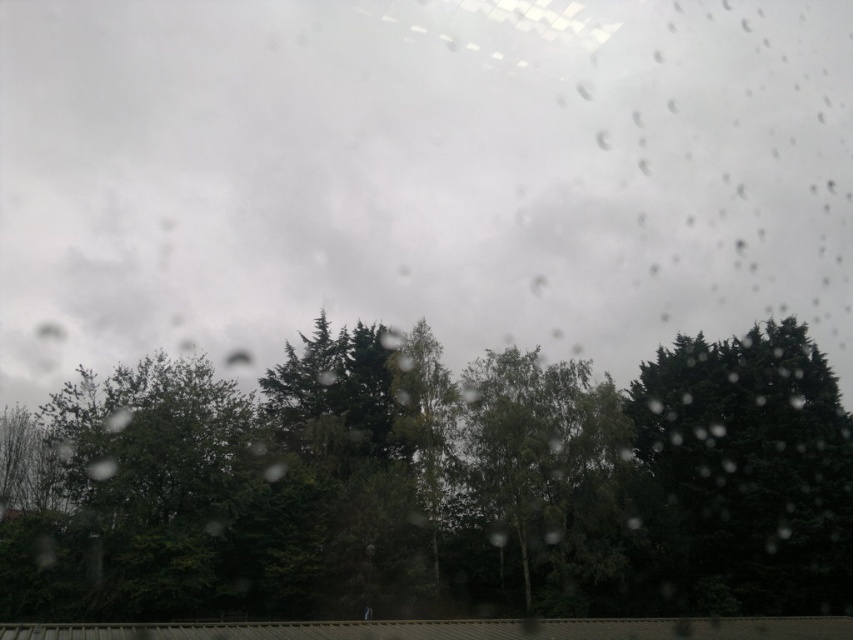
Does green matte tree at center have a smaller size compared to green leafy tree at center?

Actually, green matte tree at center might be larger than green leafy tree at center.

Is point (349, 573) positioned after point (549, 515)?

No, (349, 573) is in front of (549, 515).

You are a GUI agent. You are given a task and a screenshot of the screen. Output one action in this format:
    pyautogui.click(x=<x>, y=<y>)
    Task: Click on the green matte tree at center
    This screenshot has width=853, height=640.
    Given the screenshot: What is the action you would take?
    click(x=453, y=490)

What are the coordinates of `green matte tree at center` in the screenshot? It's located at (453, 490).

Can you confirm if dark green leafy tree at right is positioned above green leafy tree at center?

Yes.

Based on the photo, does dark green leafy tree at right appear on the left side of green leafy tree at center?

No, dark green leafy tree at right is not to the left of green leafy tree at center.

The image size is (853, 640). What do you see at coordinates (750, 468) in the screenshot? I see `dark green leafy tree at right` at bounding box center [750, 468].

I want to click on dark green leafy tree at right, so click(750, 468).

From the picture: Does green matte tree at center have a lesser width compared to dark green leafy tree at right?

Incorrect, green matte tree at center's width is not less than dark green leafy tree at right's.

Is green matte tree at center bigger than dark green leafy tree at right?

Yes.

Find the location of `green matte tree at center`. green matte tree at center is located at coordinates (453, 490).